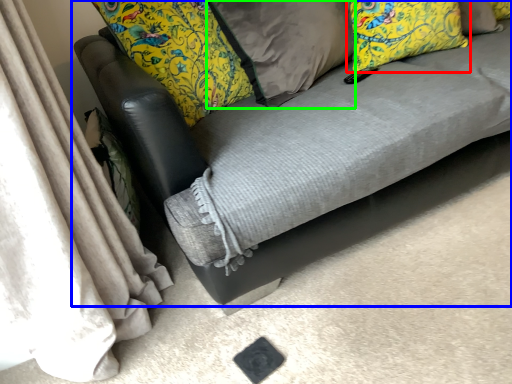
Question: Which object is the farthest from pillow (highlighted by a red box)? Choose among these: studio couch (highlighted by a blue box) or pillow (highlighted by a green box).

Choices:
 (A) studio couch
 (B) pillow

Answer: (A)